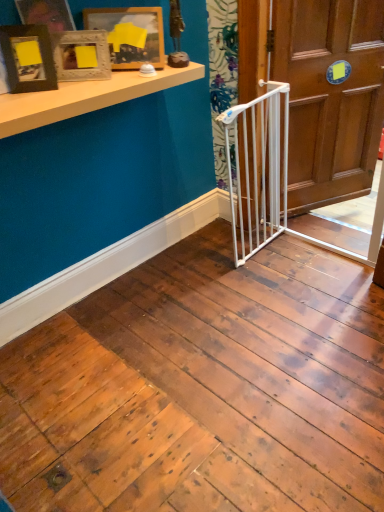
Locate an element on the screen. free space above white matte shelf at upper left (from a real-world perspective) is located at coordinates (80, 86).